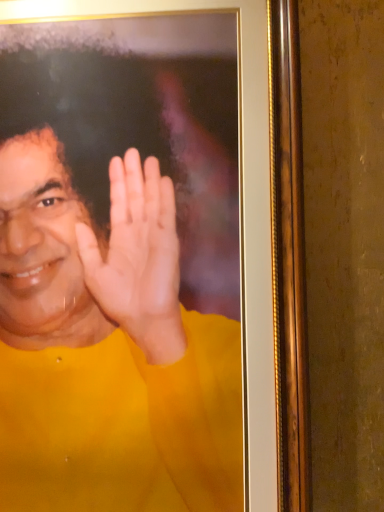
Question: Should I look upward or downward to see yellow matte shirt at center?

Choices:
 (A) down
 (B) up

Answer: (B)